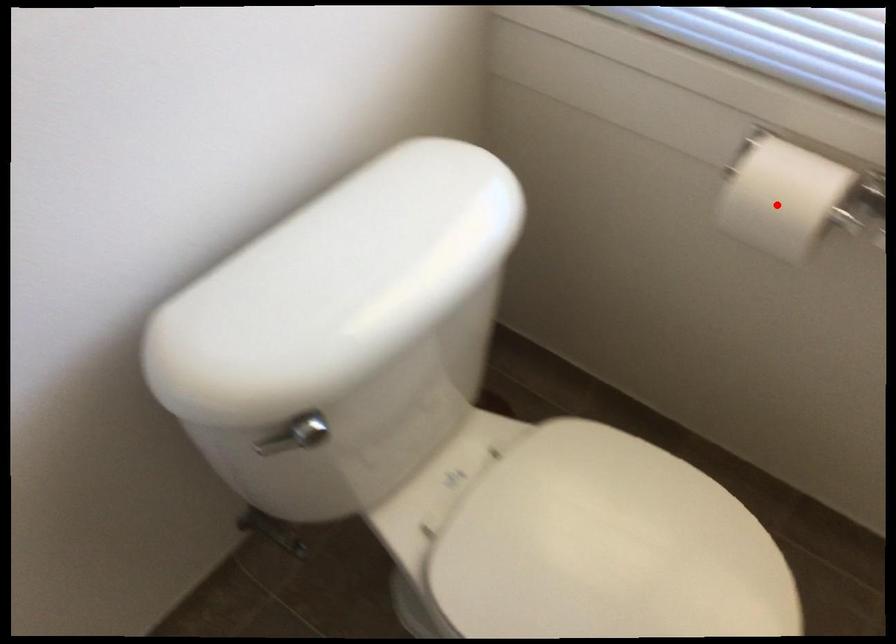
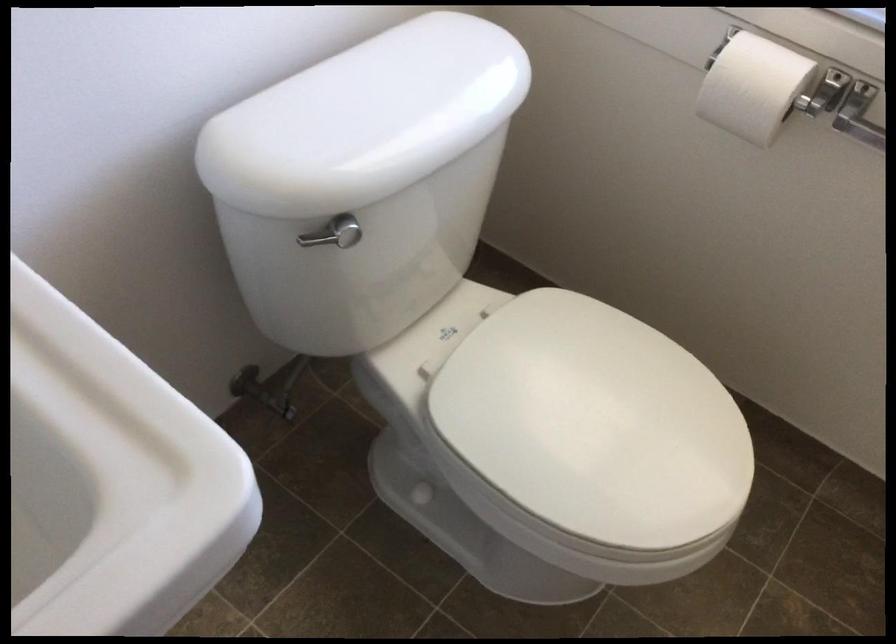
Question: I am providing you with two images of the same scene from different viewpoints. A red point is marked on the first image. At the location where the point appears in image 1, is it still visible in image 2?

Choices:
 (A) Yes
 (B) No

Answer: (A)